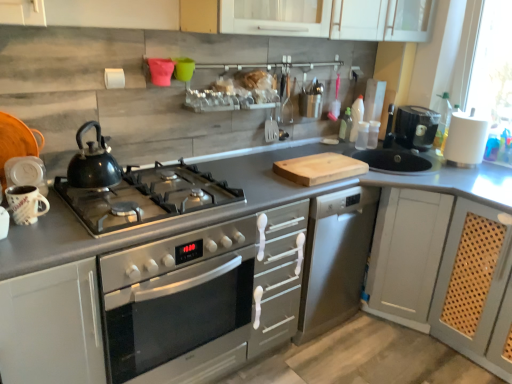
Image resolution: width=512 pixels, height=384 pixels. Find the location of `vacant space to the right of matte ceramic mug at left, the 1th appliance from the left`. vacant space to the right of matte ceramic mug at left, the 1th appliance from the left is located at coordinates (61, 231).